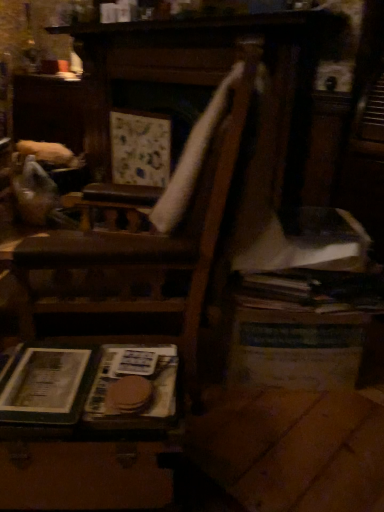
Question: Does wooden suitcase at lower left, which ranks as the second table in back-to-front order, appear on the left side of wooden table at lower right, marked as the 1th table in a back-to-front arrangement?

Choices:
 (A) no
 (B) yes

Answer: (B)

Question: From the image's perspective, is wooden suitcase at lower left, which is counted as the 1th table, starting from the left, located beneath wooden table at lower right, marked as the 1th table in a back-to-front arrangement?

Choices:
 (A) yes
 (B) no

Answer: (A)

Question: Could you tell me if wooden suitcase at lower left, which is counted as the 1th table, starting from the left, is turned towards wooden table at lower right, the second table viewed from the front?

Choices:
 (A) no
 (B) yes

Answer: (A)

Question: Is wooden suitcase at lower left, which is counted as the 1th table, starting from the left, at the right side of wooden table at lower right, arranged as the first table when viewed from the right?

Choices:
 (A) no
 (B) yes

Answer: (A)

Question: Is the depth of wooden suitcase at lower left, which ranks as the second table in back-to-front order, greater than that of wooden table at lower right, marked as the 1th table in a back-to-front arrangement?

Choices:
 (A) yes
 (B) no

Answer: (B)

Question: From a real-world perspective, is wooden suitcase at lower left, which is counted as the 1th table, starting from the left, on wooden table at lower right, the second table when ordered from left to right?

Choices:
 (A) no
 (B) yes

Answer: (A)

Question: Does wooden suitcase at lower left, the second table from the right, have a lesser width compared to brown paper at lower left, the first paperback book positioned from the right?

Choices:
 (A) no
 (B) yes

Answer: (A)

Question: Is wooden suitcase at lower left, the 1th table from the front, bigger than brown paper at lower left, the second paperback book viewed from the left?

Choices:
 (A) yes
 (B) no

Answer: (A)

Question: Is wooden suitcase at lower left, the second table from the right, outside brown paper at lower left, the first paperback book positioned from the right?

Choices:
 (A) no
 (B) yes

Answer: (B)

Question: Is wooden suitcase at lower left, which is counted as the 1th table, starting from the left, to the right of brown paper at lower left, the first paperback book positioned from the right, from the viewer's perspective?

Choices:
 (A) yes
 (B) no

Answer: (B)

Question: Is wooden suitcase at lower left, the second table from the right, wider than brown paper at lower left, the first paperback book positioned from the right?

Choices:
 (A) no
 (B) yes

Answer: (B)

Question: Can you confirm if wooden suitcase at lower left, which is counted as the 1th table, starting from the left, is taller than brown paper at lower left, the first paperback book positioned from the right?

Choices:
 (A) no
 (B) yes

Answer: (B)

Question: Is wooden suitcase at lower left, which ranks as the second table in back-to-front order, touching hardcover book at lower left, acting as the first paperback book starting from the left?

Choices:
 (A) no
 (B) yes

Answer: (B)